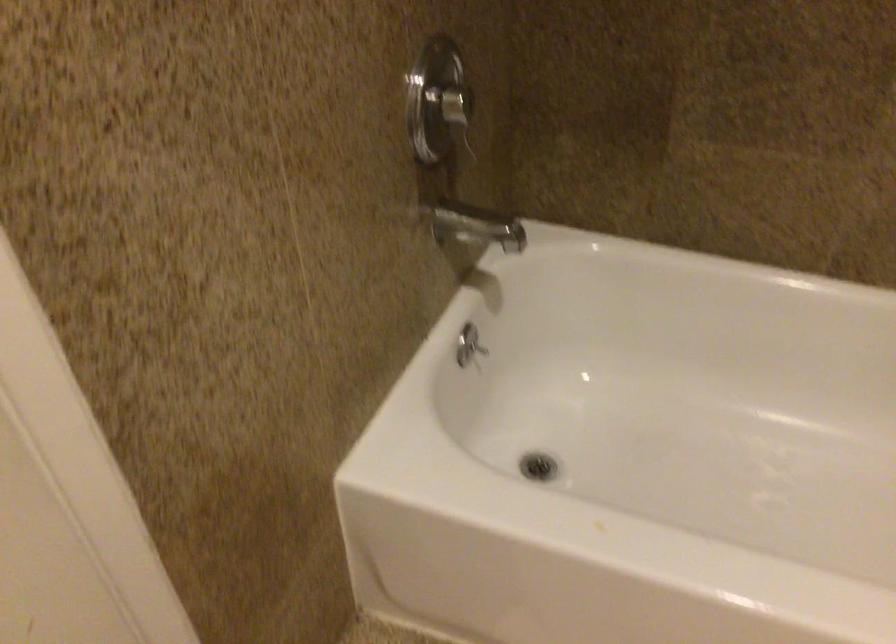
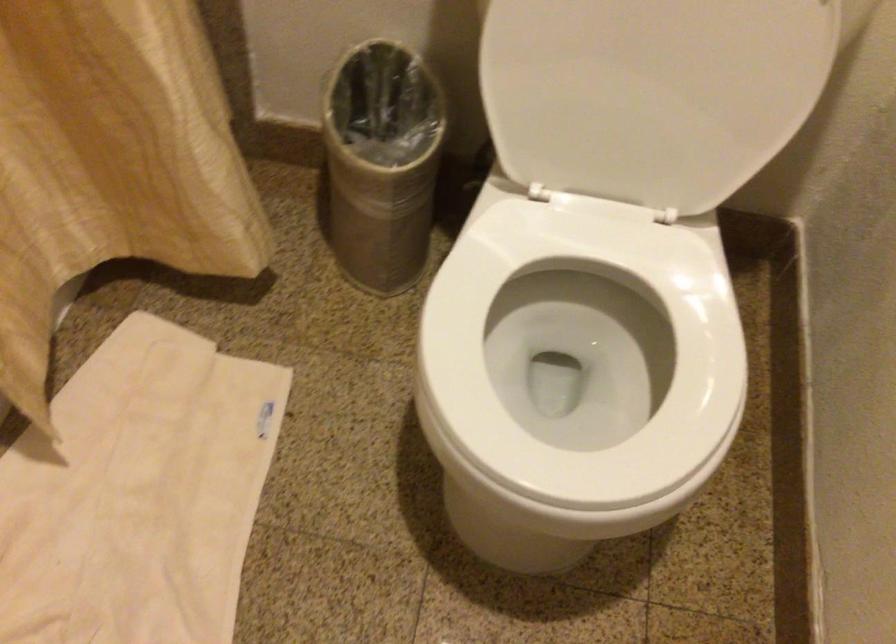
Based on the continuous images, in which direction is the camera rotating?

The camera's rotation is toward right-down.